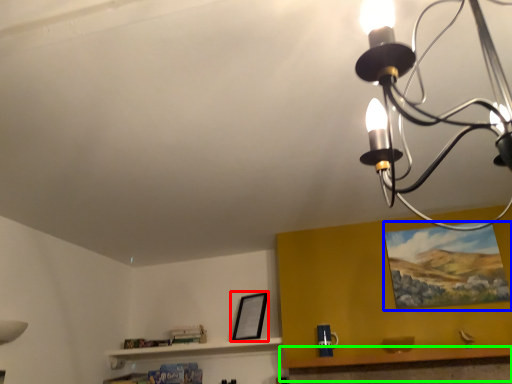
Question: Considering the real-world distances, which object is farthest from picture frame (highlighted by a red box)? picture frame (highlighted by a blue box) or table (highlighted by a green box)?

Choices:
 (A) picture frame
 (B) table

Answer: (A)